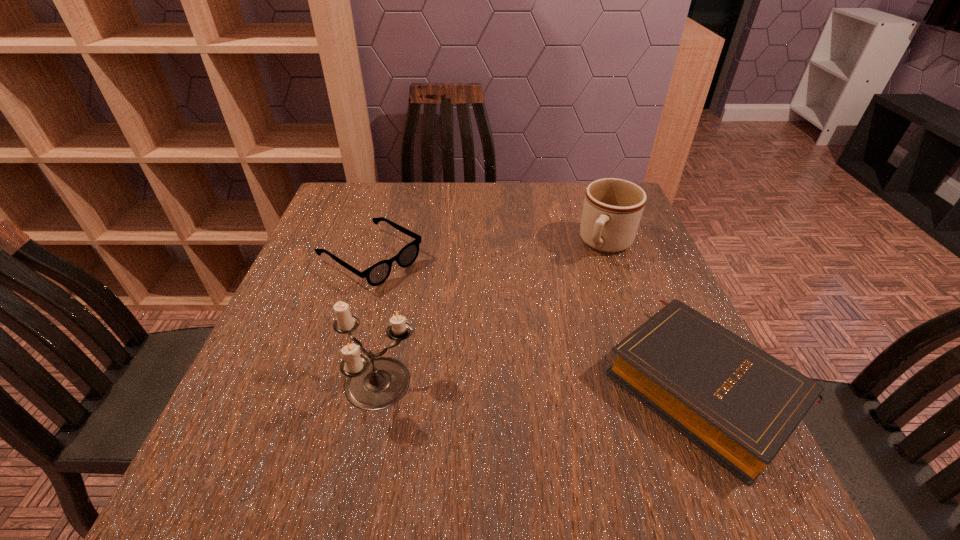
The width and height of the screenshot is (960, 540). Identify the location of free spot between the spectacles and the Bible. (537, 321).

This screenshot has width=960, height=540. Find the location of `free spot between the Bible and the mug`. free spot between the Bible and the mug is located at coordinates [655, 314].

Identify the location of free space between the spectacles and the mug. (489, 251).

This screenshot has height=540, width=960. In order to click on free space between the third shortest object and the candle holder in this screenshot , I will do `click(493, 315)`.

This screenshot has height=540, width=960. Identify the location of free spot between the candle holder and the spectacles. (375, 322).

Identify the location of unoccupied position between the mug and the tallest object. (493, 315).

What are the coordinates of `object that is the third nearest to the Bible` in the screenshot? It's located at (377, 274).

This screenshot has width=960, height=540. In order to click on object that is the second closest to the third shortest object in this screenshot , I will do `click(377, 274)`.

I want to click on free space that satisfies the following two spatial constraints: 1. on the back side of the candle holder; 2. on the left side of the Bible, so click(379, 384).

The height and width of the screenshot is (540, 960). I want to click on vacant area that satisfies the following two spatial constraints: 1. on the back side of the Bible; 2. on the right side of the tallest object, so click(x=379, y=384).